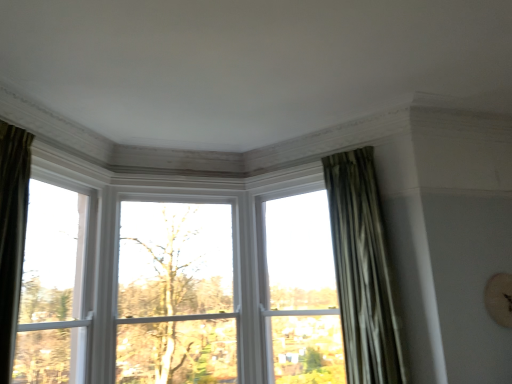
Question: Is green leafy tree at center placed right next to clear glass window at center, arranged as the second window when viewed from the left?

Choices:
 (A) yes
 (B) no

Answer: (B)

Question: Is green leafy tree at center thinner than clear glass window at center, the 1th window positioned from the right?

Choices:
 (A) no
 (B) yes

Answer: (B)

Question: Can you confirm if green leafy tree at center is taller than clear glass window at center, the 1th window positioned from the right?

Choices:
 (A) yes
 (B) no

Answer: (B)

Question: Considering the relative sizes of green leafy tree at center and clear glass window at center, the 1th window positioned from the right, in the image provided, is green leafy tree at center wider than clear glass window at center, the 1th window positioned from the right,?

Choices:
 (A) no
 (B) yes

Answer: (A)

Question: Would you say clear glass window at center, the 1th window positioned from the right, is part of green leafy tree at center's contents?

Choices:
 (A) yes
 (B) no

Answer: (B)

Question: From the image's perspective, is white wood window at left, which is the 2th window from right to left, positioned above or below clear glass window at center, arranged as the second window when viewed from the left?

Choices:
 (A) below
 (B) above

Answer: (B)

Question: Considering their positions, is white wood window at left, which ranks as the first window in left-to-right order, located in front of or behind clear glass window at center, arranged as the second window when viewed from the left?

Choices:
 (A) front
 (B) behind

Answer: (A)

Question: Is white wood window at left, which ranks as the first window in left-to-right order, inside or outside of clear glass window at center, the 1th window positioned from the right?

Choices:
 (A) outside
 (B) inside

Answer: (A)

Question: In terms of size, does white wood window at left, which is the 2th window from right to left, appear bigger or smaller than clear glass window at center, the 1th window positioned from the right?

Choices:
 (A) small
 (B) big

Answer: (A)

Question: From the image's perspective, is white wood window at left, which is the 2th window from right to left, above or below green leafy tree at center?

Choices:
 (A) above
 (B) below

Answer: (A)

Question: In terms of size, does white wood window at left, which is the 2th window from right to left, appear bigger or smaller than green leafy tree at center?

Choices:
 (A) small
 (B) big

Answer: (A)

Question: Is point (81, 334) closer or farther from the camera than point (121, 334)?

Choices:
 (A) farther
 (B) closer

Answer: (B)

Question: Is white wood window at left, which is the 2th window from right to left, inside the boundaries of green leafy tree at center, or outside?

Choices:
 (A) outside
 (B) inside

Answer: (A)

Question: In terms of height, does green leafy tree at center look taller or shorter compared to silky green curtain at right?

Choices:
 (A) short
 (B) tall

Answer: (A)

Question: Is green leafy tree at center situated inside silky green curtain at right or outside?

Choices:
 (A) inside
 (B) outside

Answer: (B)